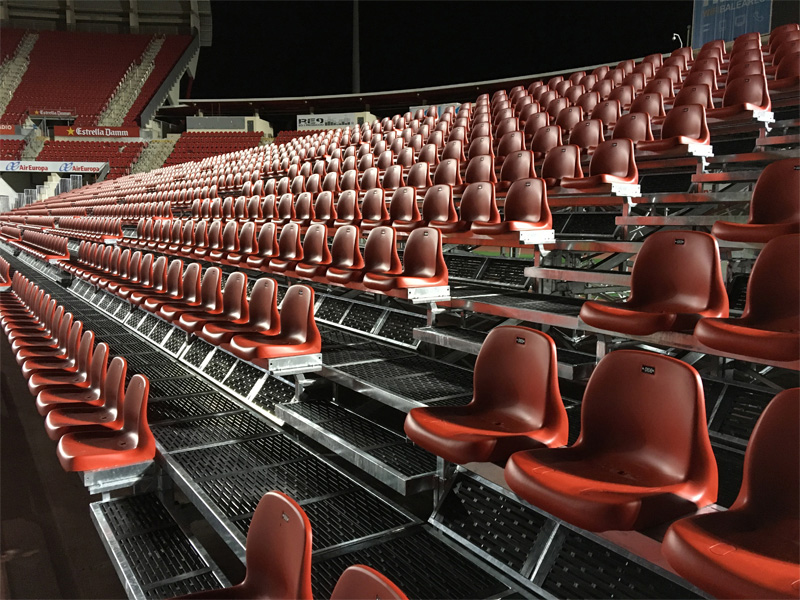
I want to click on risers, so click(x=162, y=556), click(x=242, y=487), click(x=361, y=416), click(x=409, y=380), click(x=481, y=334), click(x=544, y=290), click(x=590, y=255), click(x=660, y=218), click(x=686, y=195), click(x=730, y=154).